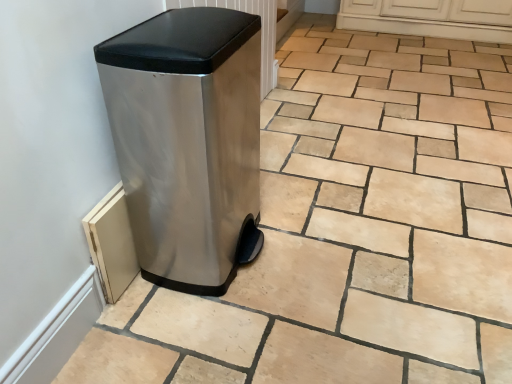
Locate an element on the screen. Image resolution: width=512 pixels, height=384 pixels. vacant area located to the right-hand side of stainless steel trash can at left is located at coordinates (323, 249).